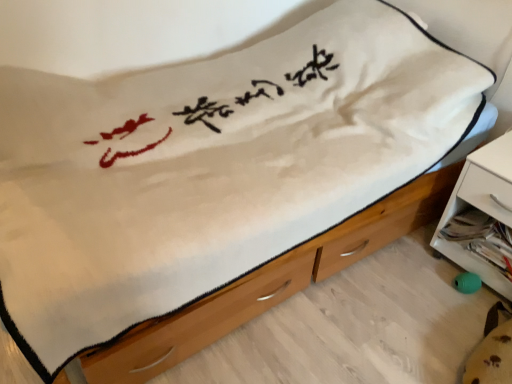
Identify the location of wooden chest of drawers at center. (267, 285).

In order to face wooden chest of drawers at center, should I rotate leftwards or rightwards?

You should rotate right by 5.819 degrees.

What do you see at coordinates (267, 285) in the screenshot? This screenshot has height=384, width=512. I see `wooden chest of drawers at center` at bounding box center [267, 285].

What is the approximate width of white plastic nightstand at lower right?

The width of white plastic nightstand at lower right is 15.22 inches.

Describe the element at coordinates (482, 217) in the screenshot. I see `white plastic nightstand at lower right` at that location.

What is the approximate height of white plastic nightstand at lower right?

The height of white plastic nightstand at lower right is 20.61 inches.

Image resolution: width=512 pixels, height=384 pixels. Find the location of `white plastic nightstand at lower right`. white plastic nightstand at lower right is located at coordinates (482, 217).

Find the location of a particular element. wooden chest of drawers at center is located at coordinates point(267,285).

Is white plastic nightstand at lower right at the left side of wooden chest of drawers at center?

No, white plastic nightstand at lower right is not to the left of wooden chest of drawers at center.

In the image, is white plastic nightstand at lower right positioned in front of or behind wooden chest of drawers at center?

In the image, white plastic nightstand at lower right appears behind wooden chest of drawers at center.

Which is behind, point (455, 192) or point (319, 260)?

The point (455, 192) is farther.

From the image's perspective, is white plastic nightstand at lower right located above or below wooden chest of drawers at center?

Clearly, from the image's perspective, white plastic nightstand at lower right is above wooden chest of drawers at center.

From a real-world perspective, does white plastic nightstand at lower right sit lower than wooden chest of drawers at center?

Incorrect, from a real-world perspective, white plastic nightstand at lower right is higher than wooden chest of drawers at center.

Based on the photo, considering the relative sizes of white plastic nightstand at lower right and wooden chest of drawers at center in the image provided, is white plastic nightstand at lower right wider than wooden chest of drawers at center?

In fact, white plastic nightstand at lower right might be narrower than wooden chest of drawers at center.

From the picture: Can you confirm if white plastic nightstand at lower right is shorter than wooden chest of drawers at center?

No.

Does white plastic nightstand at lower right have a smaller size compared to wooden chest of drawers at center?

No, white plastic nightstand at lower right is not smaller than wooden chest of drawers at center.

Is wooden chest of drawers at center completely or partially inside white plastic nightstand at lower right?

Definitely not — wooden chest of drawers at center is not inside white plastic nightstand at lower right.

Is white plastic nightstand at lower right far from wooden chest of drawers at center?

That's not correct — white plastic nightstand at lower right is a little close to wooden chest of drawers at center.

Is white plastic nightstand at lower right facing away from wooden chest of drawers at center?

No, white plastic nightstand at lower right's orientation is not away from wooden chest of drawers at center.

How much distance is there between white plastic nightstand at lower right and wooden chest of drawers at center?

white plastic nightstand at lower right is 15.05 inches away from wooden chest of drawers at center.

Image resolution: width=512 pixels, height=384 pixels. Identify the location of the chest of drawers located below the white plastic nightstand at lower right (from the image's perspective). (267, 285).

Which object is positioned more to the left, wooden chest of drawers at center or white plastic nightstand at lower right?

wooden chest of drawers at center.

Looking at this image, is the position of wooden chest of drawers at center more distant than that of white plastic nightstand at lower right?

No, wooden chest of drawers at center is closer to the camera.

Considering the positions of point (305, 278) and point (478, 164), is point (305, 278) closer or farther from the camera than point (478, 164)?

Clearly, point (305, 278) is more distant from the camera than point (478, 164).

From the image's perspective, is wooden chest of drawers at center located beneath white plastic nightstand at lower right?

Yes, from the image's perspective, wooden chest of drawers at center is beneath white plastic nightstand at lower right.

From a real-world perspective, is wooden chest of drawers at center positioned above or below white plastic nightstand at lower right?

From a real-world perspective, wooden chest of drawers at center is physically below white plastic nightstand at lower right.

Looking at their sizes, would you say wooden chest of drawers at center is wider or thinner than white plastic nightstand at lower right?

wooden chest of drawers at center is wider than white plastic nightstand at lower right.

From the picture: Which of these two, wooden chest of drawers at center or white plastic nightstand at lower right, stands shorter?

Standing shorter between the two is wooden chest of drawers at center.

Based on their sizes in the image, would you say wooden chest of drawers at center is bigger or smaller than white plastic nightstand at lower right?

wooden chest of drawers at center is smaller than white plastic nightstand at lower right.

Could white plastic nightstand at lower right be considered to be inside wooden chest of drawers at center?

No, white plastic nightstand at lower right is located outside of wooden chest of drawers at center.

Is wooden chest of drawers at center placed right next to white plastic nightstand at lower right?

wooden chest of drawers at center is not next to white plastic nightstand at lower right, and they're not touching.

Is white plastic nightstand at lower right at the back of wooden chest of drawers at center?

No.

Where is `chest of drawers below the white plastic nightstand at lower right (from a real-world perspective)`? Image resolution: width=512 pixels, height=384 pixels. chest of drawers below the white plastic nightstand at lower right (from a real-world perspective) is located at coordinates coord(267,285).

Where is `chest of drawers in front of the white plastic nightstand at lower right`? The image size is (512, 384). chest of drawers in front of the white plastic nightstand at lower right is located at coordinates click(x=267, y=285).

Find the location of a particular element. The width and height of the screenshot is (512, 384). nightstand behind the wooden chest of drawers at center is located at coordinates (482, 217).